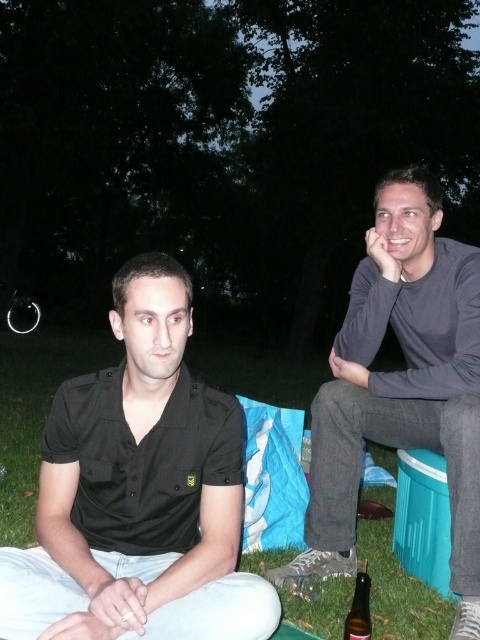
Is gray cotton shirt at right to the left of brown glass bottle at lower right from the viewer's perspective?

Incorrect, gray cotton shirt at right is not on the left side of brown glass bottle at lower right.

Measure the distance between gray cotton shirt at right and camera.

1.84 meters

Identify the location of gray cotton shirt at right. (400, 387).

What do you see at coordinates (139, 492) in the screenshot? This screenshot has width=480, height=640. I see `black matte shirt at left` at bounding box center [139, 492].

Between point (107, 404) and point (363, 586), which one is positioned in front?

Positioned in front is point (107, 404).

Identify the location of black matte shirt at left. The width and height of the screenshot is (480, 640). (139, 492).

Between black matte shirt at left and gray cotton shirt at right, which one is positioned lower?

Positioned lower is black matte shirt at left.

Measure the distance from black matte shirt at left to gray cotton shirt at right.

A distance of 32.55 inches exists between black matte shirt at left and gray cotton shirt at right.

Between point (0, 566) and point (337, 368), which one is positioned in front?

Point (0, 566) is in front.

This screenshot has width=480, height=640. Identify the location of black matte shirt at left. (139, 492).